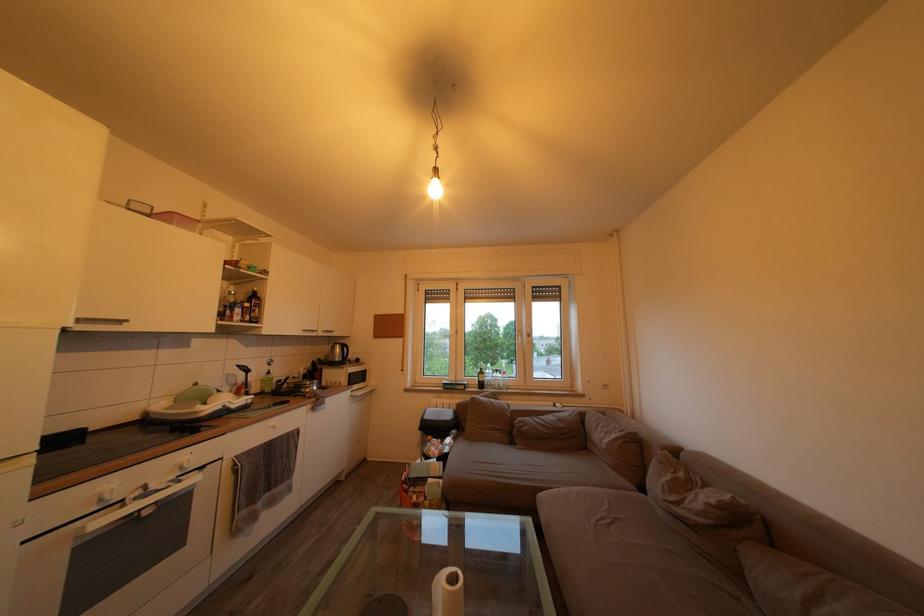
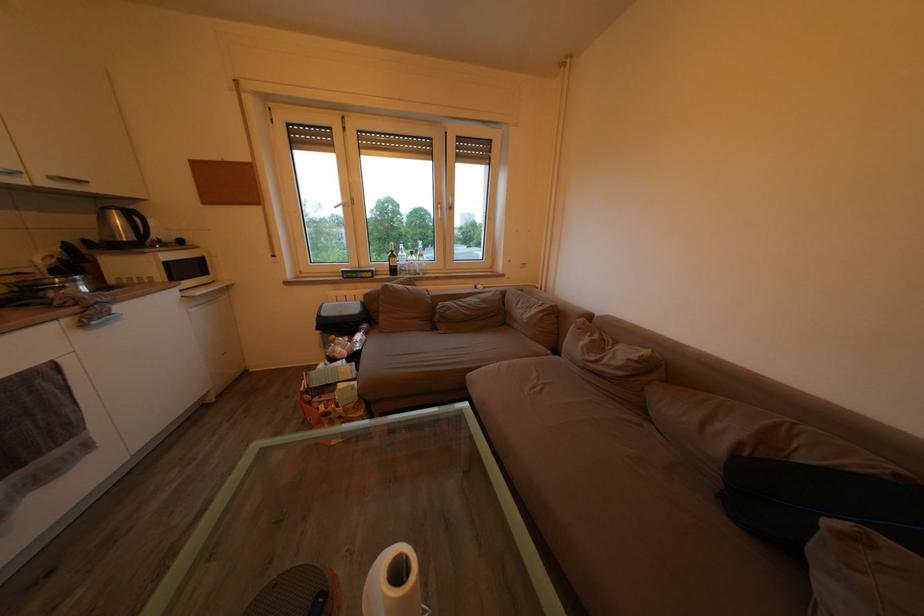
The first image is from the beginning of the video and the second image is from the end. How did the camera likely rotate when shooting the video?

The rotation direction of the camera is right-down.